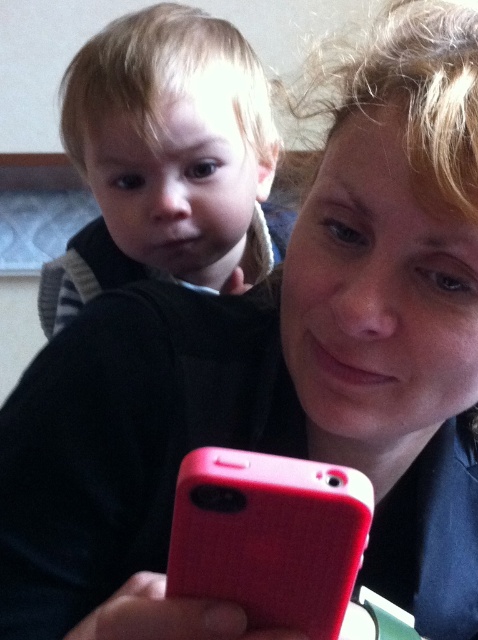
Can you confirm if smooth blond hair toddler at upper left is positioned below rubberized red phone at lower center?

No, smooth blond hair toddler at upper left is not below rubberized red phone at lower center.

Does smooth blond hair toddler at upper left appear on the right side of rubberized red phone at lower center?

In fact, smooth blond hair toddler at upper left is to the left of rubberized red phone at lower center.

I want to click on smooth blond hair toddler at upper left, so click(164, 157).